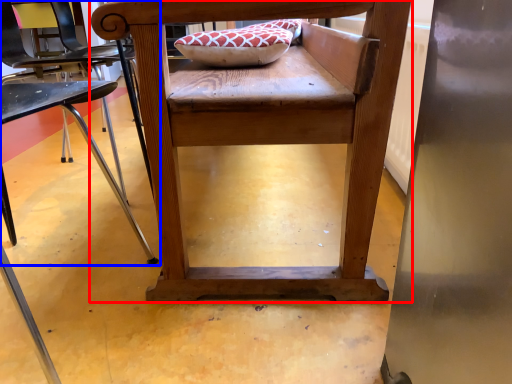
Question: Which object is closer to the camera taking this photo, chair (highlighted by a red box) or chair (highlighted by a blue box)?

Choices:
 (A) chair
 (B) chair

Answer: (B)